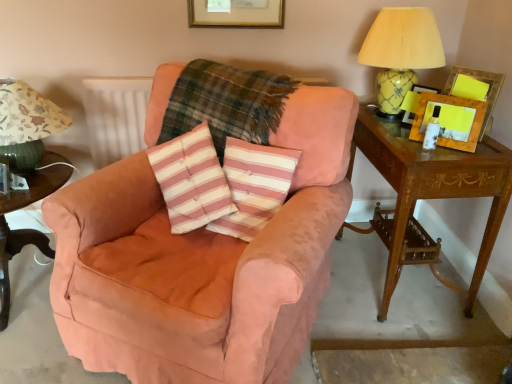
Locate an element on the screen. The image size is (512, 384). free space in front of mahogany wood side table at right is located at coordinates click(x=411, y=334).